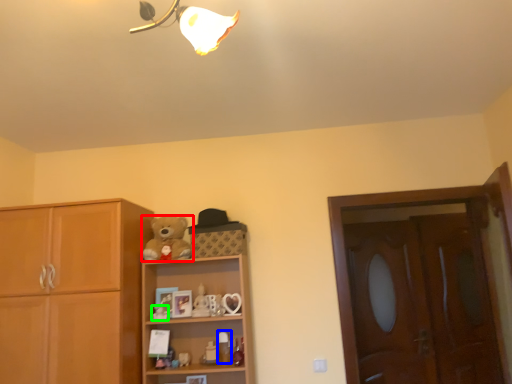
Question: Considering the real-world distances, which object is closest to teddy bear (highlighted by a red box)? toy (highlighted by a blue box) or toy (highlighted by a green box).

Choices:
 (A) toy
 (B) toy

Answer: (B)